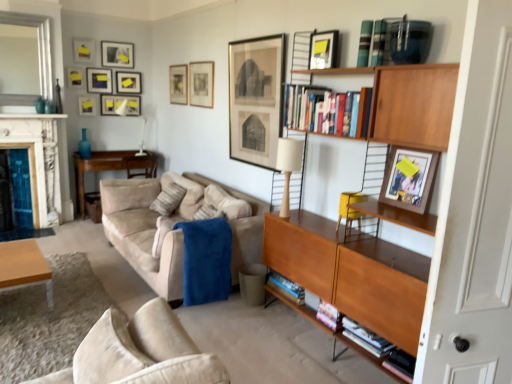
This screenshot has width=512, height=384. In order to click on blank space situated above white matte lamp at center (from a real-world perspective) in this screenshot , I will do `click(293, 132)`.